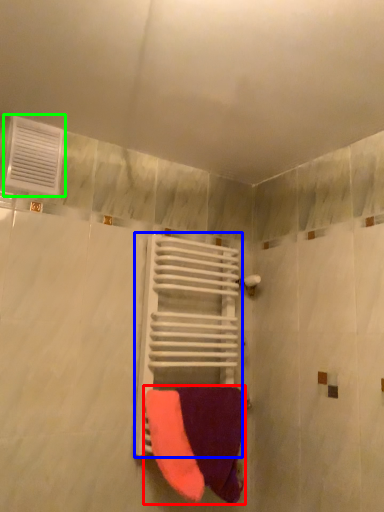
Question: Estimate the real-world distances between objects in this image. Which object is farther from towel (highlighted by a red box), balustrade (highlighted by a blue box) or air conditioning (highlighted by a green box)?

Choices:
 (A) balustrade
 (B) air conditioning

Answer: (B)